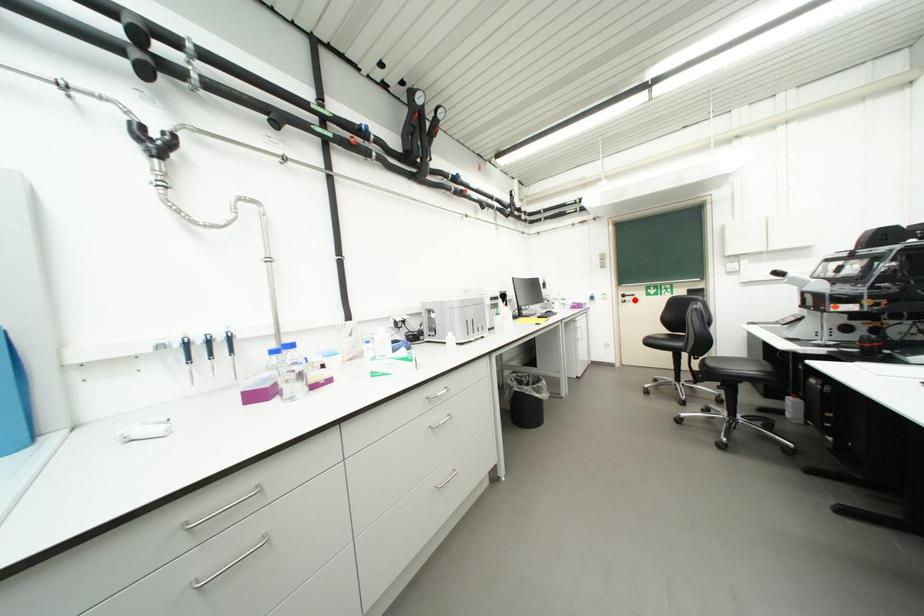
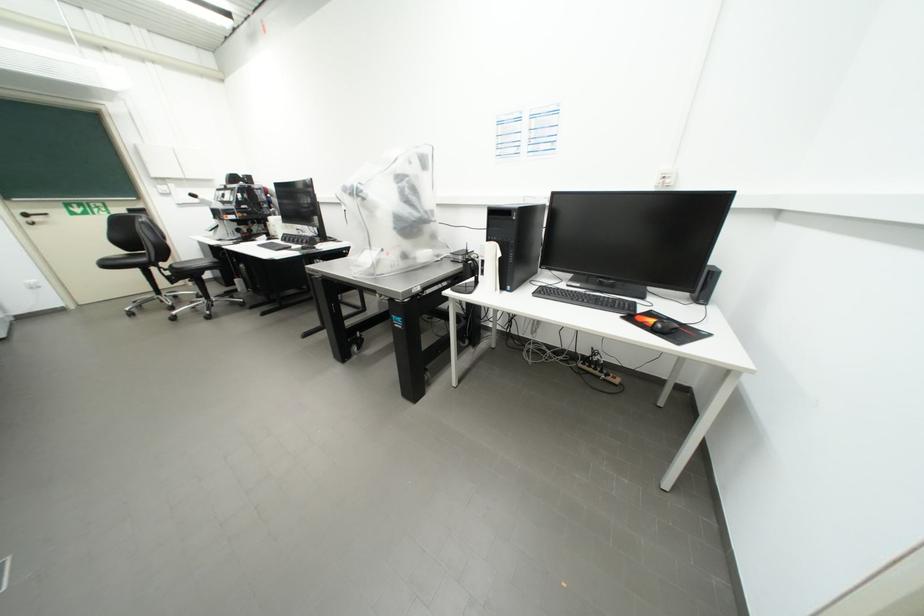
Where in the second image is the point corresponding to the highlighted location from the first image?

(43, 220)